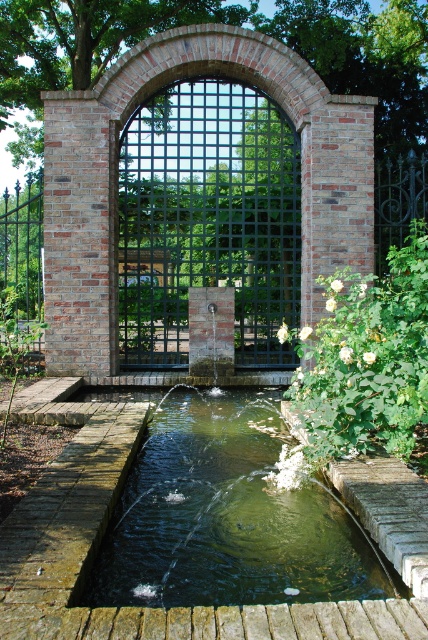
Question: Which object is farther from the camera taking this photo?

Choices:
 (A) clear glass pond at center
 (B) white matte flowers at right
 (C) green metal gate at center

Answer: (C)

Question: Among these objects, which one is nearest to the camera?

Choices:
 (A) green metal gate at center
 (B) white matte flowers at right
 (C) clear glass pond at center

Answer: (C)

Question: Which is nearer to the green metal gate at center?

Choices:
 (A) white matte flowers at right
 (B) clear glass pond at center

Answer: (A)

Question: Is green metal gate at center further to the viewer compared to white matte flowers at right?

Choices:
 (A) no
 (B) yes

Answer: (B)

Question: Is clear glass pond at center below green metal gate at center?

Choices:
 (A) no
 (B) yes

Answer: (B)

Question: Can you confirm if clear glass pond at center is smaller than green metal gate at center?

Choices:
 (A) no
 (B) yes

Answer: (B)